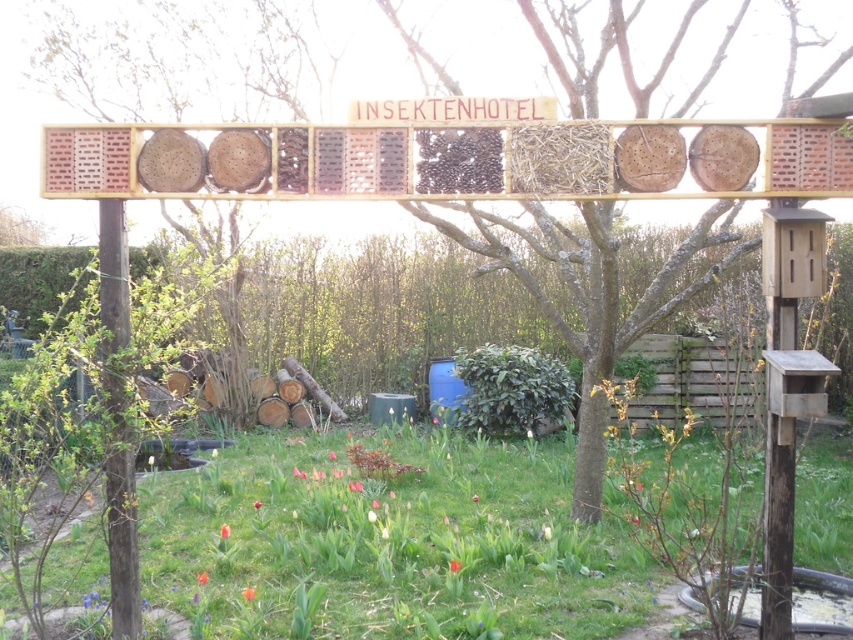
Question: Which point appears farthest from the camera in this image?

Choices:
 (A) (607, 609)
 (B) (426, 173)

Answer: (A)

Question: Does green grass at lower center appear on the right side of brown textured wood at center?

Choices:
 (A) no
 (B) yes

Answer: (A)

Question: Considering the relative positions of green grass at lower center and brown textured wood at center in the image provided, where is green grass at lower center located with respect to brown textured wood at center?

Choices:
 (A) left
 (B) right

Answer: (A)

Question: Which point is closer to the camera?

Choices:
 (A) brown textured wood at center
 (B) green grass at lower center

Answer: (A)

Question: Does green grass at lower center appear over brown textured wood at center?

Choices:
 (A) yes
 (B) no

Answer: (B)

Question: Which of the following is the closest to the observer?

Choices:
 (A) [x=422, y=164]
 (B) [x=563, y=557]

Answer: (A)